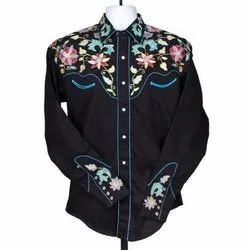
The width and height of the screenshot is (250, 250). Find the location of `mannequin`. mannequin is located at coordinates (121, 15).